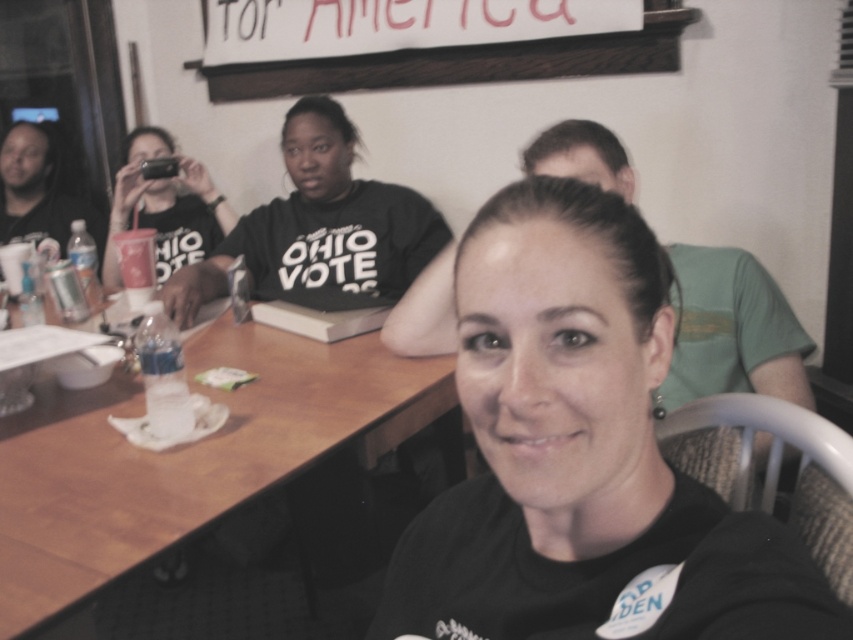
You are a photographer adjusting your camera settings. You need to ensure that both the black matte shirt at upper center and the matte black phone at upper left are in focus. Given that your camera can only maintain sharp focus within a 50 cm range, will both objects be in focus simultaneously?

The black matte shirt at upper center and the matte black phone at upper left are 58.36 centimeters apart from each other, which exceeds the camera focus range of 50 cm. Therefore, both objects cannot be in focus at the same time.

You are standing in the room and want to see the black matte shirt at upper center clearly. Is the wooden table at center blocking your view of it?

The wooden table at center is in front of the black matte shirt at upper center, so it is blocking the view of the black matte shirt at upper center.

You are a photographer taking a picture of two people wearing black matte shirts. The two shirts are labeled as black matte shirt at center and black matte shirt at upper center. Which shirt is closer to you?

The black matte shirt at center is closer to the viewer than the black matte shirt at upper center.